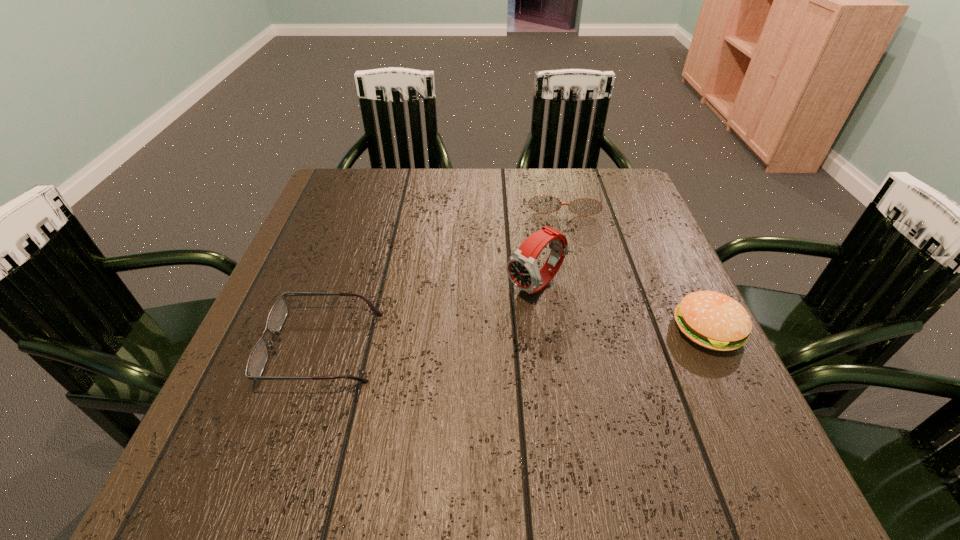
Identify the location of vacant space at the left edge of the desktop. Image resolution: width=960 pixels, height=540 pixels. (306, 322).

This screenshot has width=960, height=540. Identify the location of free location at the right edge. (616, 266).

The width and height of the screenshot is (960, 540). I want to click on free space at the far left corner, so pos(334,199).

The image size is (960, 540). Identify the location of vacant space at the far right corner of the desktop. (605, 173).

The image size is (960, 540). Find the location of `free space between the patty and the tallest object`. free space between the patty and the tallest object is located at coordinates (622, 308).

Where is `free space that is in between the leftmost object and the farthest object`? The width and height of the screenshot is (960, 540). free space that is in between the leftmost object and the farthest object is located at coordinates (444, 274).

The height and width of the screenshot is (540, 960). What are the coordinates of `free point between the leftmost object and the watch` in the screenshot? It's located at (430, 316).

The height and width of the screenshot is (540, 960). I want to click on vacant area that lies between the spectacles and the rightmost object, so click(x=516, y=339).

Where is `vacant area that lies between the leftmost object and the rightmost object`? The width and height of the screenshot is (960, 540). vacant area that lies between the leftmost object and the rightmost object is located at coordinates (516, 339).

The width and height of the screenshot is (960, 540). I want to click on empty location between the sunglasses and the second tallest object, so click(636, 265).